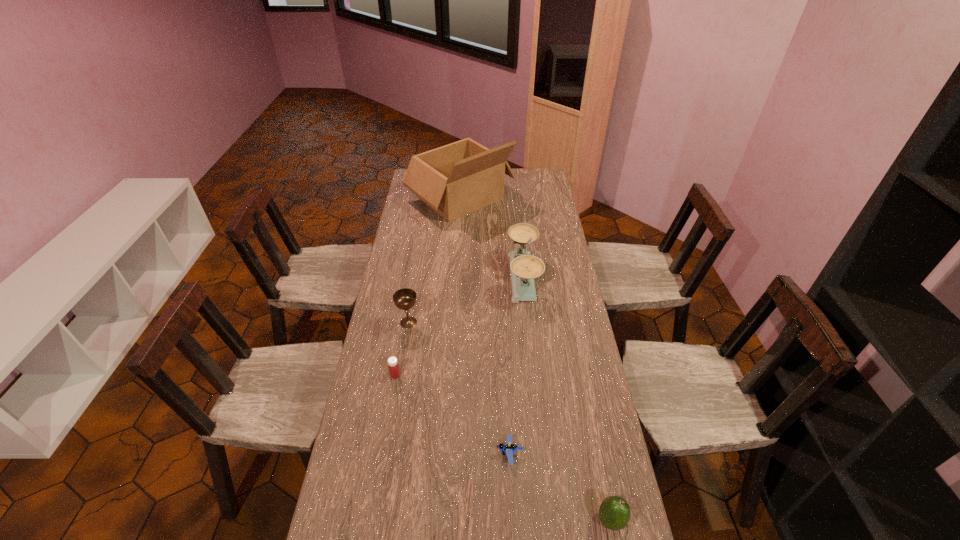
I want to click on free space between the scale and the fourth farthest object, so click(459, 327).

This screenshot has height=540, width=960. In order to click on object that can be found as the second closest to the rightmost object in this screenshot , I will do `click(393, 366)`.

The image size is (960, 540). I want to click on object that can be found as the second closest to the third tallest object, so click(525, 267).

Image resolution: width=960 pixels, height=540 pixels. I want to click on vacant region that satisfies the following two spatial constraints: 1. on the front-facing side of the avocado; 2. on the right side of the fifth farthest object, so click(x=513, y=520).

In order to click on free space in the image that satisfies the following two spatial constraints: 1. on the back side of the farthest object; 2. on the left side of the fifth tallest object in this screenshot , I will do `click(425, 198)`.

What are the coordinates of `vacant space that satisfies the following two spatial constraints: 1. on the front-facing side of the rightmost object; 2. on the right side of the scale` in the screenshot? It's located at (549, 520).

This screenshot has width=960, height=540. I want to click on blank space that satisfies the following two spatial constraints: 1. on the front-facing side of the shortest object; 2. on the left side of the rightmost object, so click(x=513, y=520).

I want to click on free space that satisfies the following two spatial constraints: 1. on the front-facing side of the second nearest object; 2. on the right side of the nearest object, so click(513, 520).

Image resolution: width=960 pixels, height=540 pixels. I want to click on free spot that satisfies the following two spatial constraints: 1. on the front-facing side of the fifth farthest object; 2. on the back side of the rightmost object, so point(513,520).

Where is `free region that satisfies the following two spatial constraints: 1. on the front-facing side of the avocado; 2. on the right side of the shortest object`? free region that satisfies the following two spatial constraints: 1. on the front-facing side of the avocado; 2. on the right side of the shortest object is located at coordinates (513, 520).